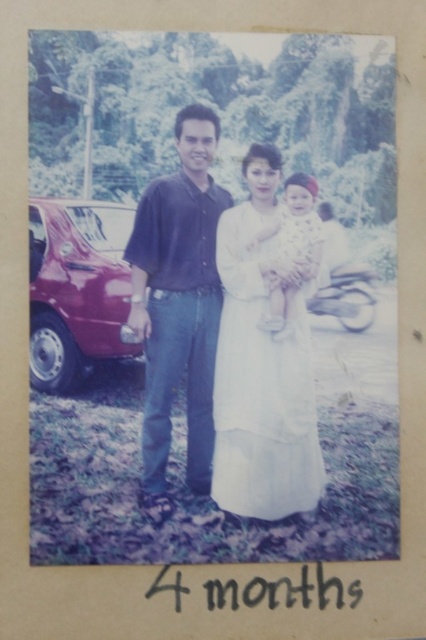
Question: Considering the real-world distances, which object is closest to the shiny maroon car at left?

Choices:
 (A) white fabric baby at center
 (B) matte dark blue shirt at center
 (C) white satin dress at center

Answer: (B)

Question: Is white satin dress at center to the right of matte dark blue shirt at center from the viewer's perspective?

Choices:
 (A) yes
 (B) no

Answer: (A)

Question: Which object appears closest to the camera in this image?

Choices:
 (A) matte dark blue shirt at center
 (B) white satin dress at center
 (C) shiny maroon car at left
 (D) white fabric baby at center

Answer: (C)

Question: Does shiny maroon car at left have a larger size compared to white fabric baby at center?

Choices:
 (A) no
 (B) yes

Answer: (B)

Question: Which of these objects is positioned closest to the shiny maroon car at left?

Choices:
 (A) matte dark blue shirt at center
 (B) white fabric baby at center
 (C) white satin dress at center

Answer: (A)

Question: Does shiny maroon car at left have a larger size compared to white fabric baby at center?

Choices:
 (A) yes
 (B) no

Answer: (A)